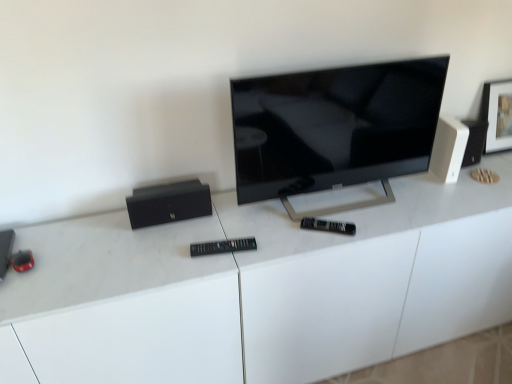
This screenshot has height=384, width=512. Identify the location of free spot to the right of black plastic remote at center. (274, 246).